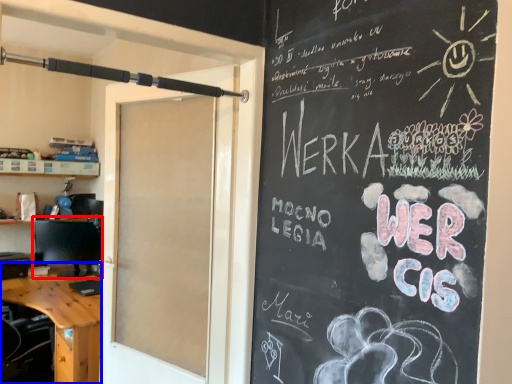
Question: Among these objects, which one is farthest to the camera, computer monitor (highlighted by a red box) or desk (highlighted by a blue box)?

Choices:
 (A) computer monitor
 (B) desk

Answer: (A)